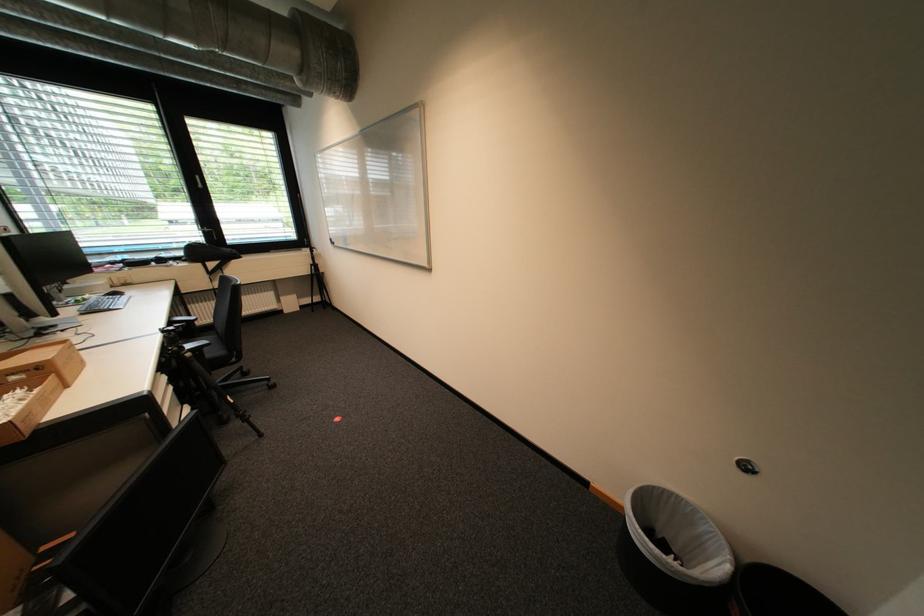
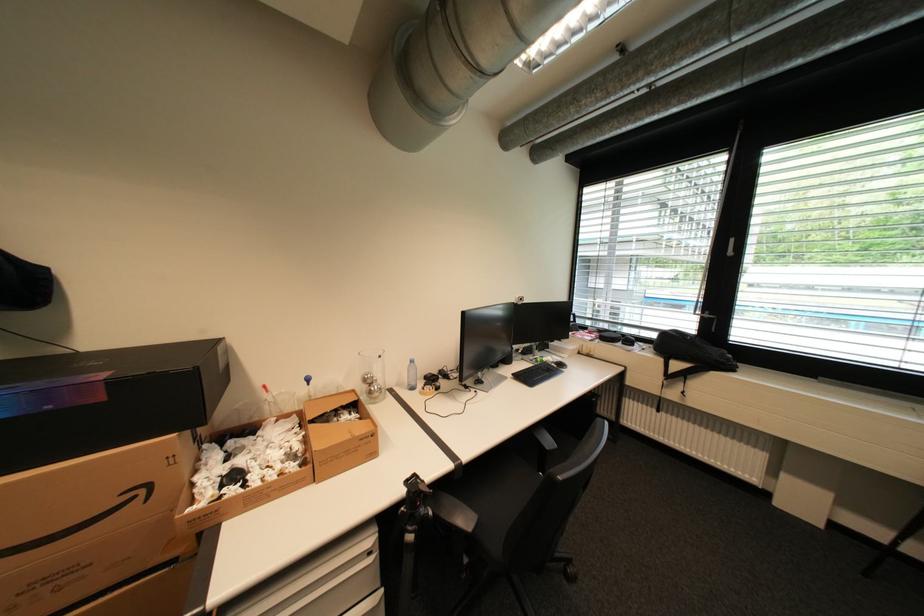
The point at (x=237, y=243) is marked in the first image. Where is the corresponding point in the second image?

(739, 339)